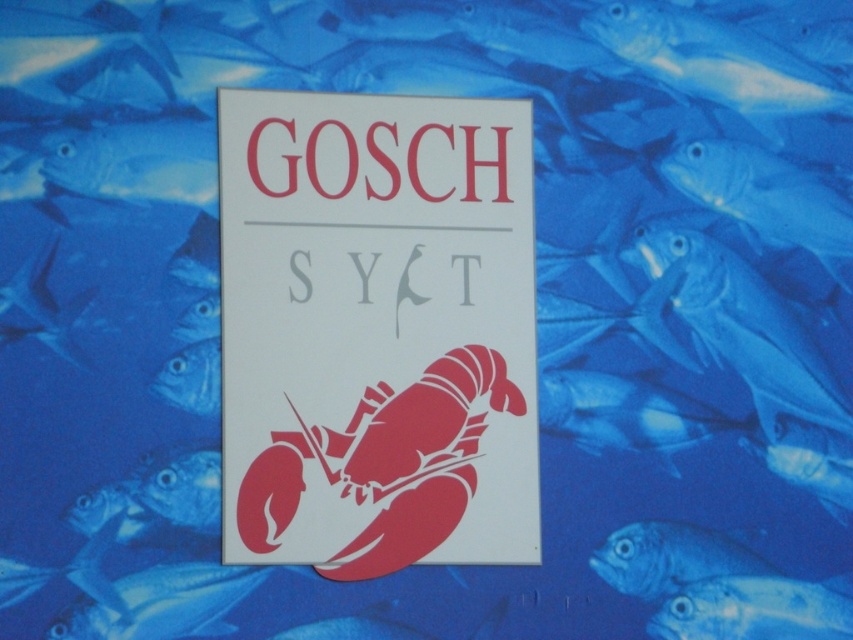
Question: Does translucent blue fish at lower right have a larger size compared to blue glossy fish at center?

Choices:
 (A) no
 (B) yes

Answer: (A)

Question: Which of the following is the farthest from the observer?

Choices:
 (A) (758, 605)
 (B) (670, 554)
 (C) (363, 278)
 (D) (416, 490)

Answer: (A)

Question: Can you confirm if white paper sign at center is bigger than translucent blue fish at lower right?

Choices:
 (A) no
 (B) yes

Answer: (B)

Question: Estimate the real-world distances between objects in this image. Which object is farther from the translucent blue fish at lower right?

Choices:
 (A) matte red text at center
 (B) gray matte text at center
 (C) blue glossy fish at center

Answer: (A)

Question: Among these objects, which one is farthest from the camera?

Choices:
 (A) gray matte text at center
 (B) translucent blue fish at lower right
 (C) white paper sign at center

Answer: (B)

Question: Considering the relative positions of blue glossy fish at center and gray matte text at center in the image provided, where is blue glossy fish at center located with respect to gray matte text at center?

Choices:
 (A) below
 (B) above

Answer: (A)